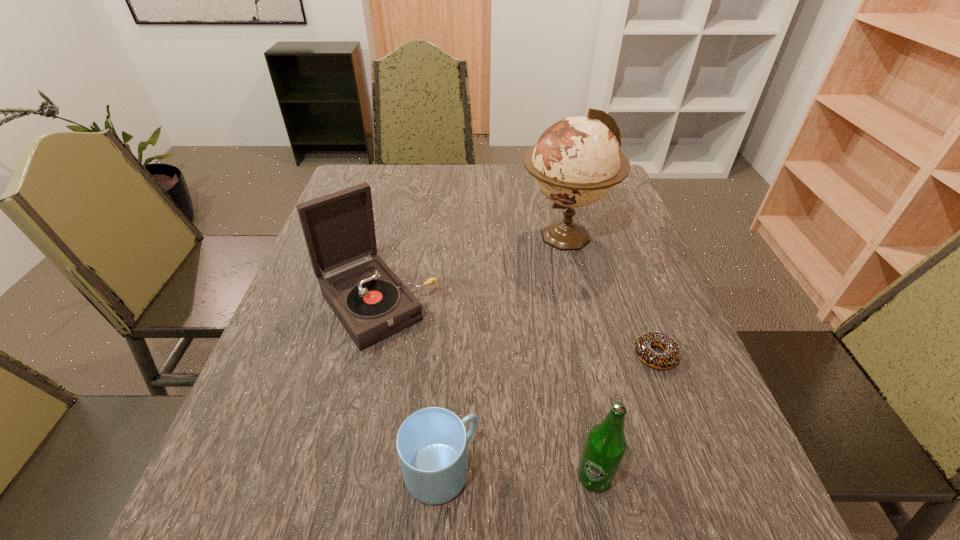
Image resolution: width=960 pixels, height=540 pixels. Find the location of `the tallest object`. the tallest object is located at coordinates (576, 161).

Where is `globe`? This screenshot has height=540, width=960. globe is located at coordinates (576, 161).

Locate an element on the screen. This screenshot has width=960, height=540. phonograph record is located at coordinates (372, 303).

The image size is (960, 540). What are the coordinates of `beer bottle` in the screenshot? It's located at (605, 446).

Where is `mug`? This screenshot has height=540, width=960. mug is located at coordinates (431, 443).

Image resolution: width=960 pixels, height=540 pixels. I want to click on the shortest object, so click(x=670, y=358).

Identify the location of vacant space located 0.120m on the front of the farthest object showing Asia. This screenshot has width=960, height=540. (475, 235).

Find the location of `vacant space located on the front of the farthest object showing Asia`. vacant space located on the front of the farthest object showing Asia is located at coordinates (446, 235).

Find the location of `free space located on the front of the farthest object showing Asia`. free space located on the front of the farthest object showing Asia is located at coordinates (483, 235).

Identify the location of free region located 0.150m on the back of the fourth shortest object. The width and height of the screenshot is (960, 540). (394, 232).